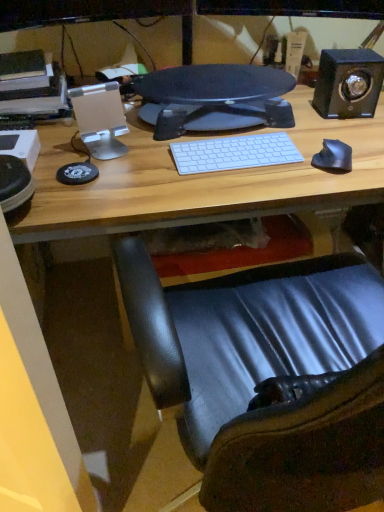
Find the location of a particular element. free spot in front of white matte keyboard at center is located at coordinates (230, 186).